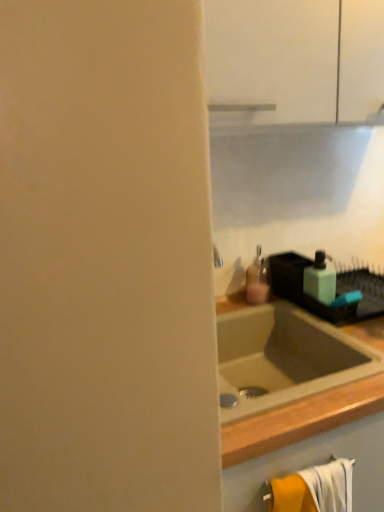
I want to click on vacant space in front of green matte soap dispenser at right, which is the 2th soap dispenser in left-to-right order, so click(x=333, y=318).